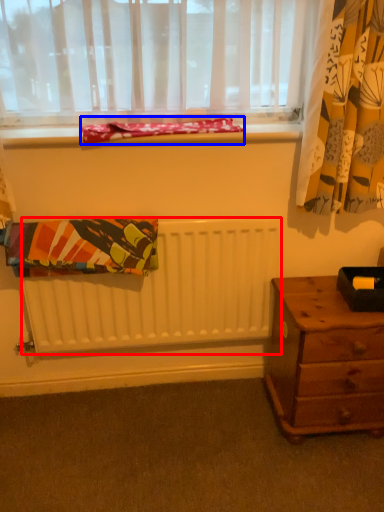
Question: Which of the following is the farthest to the observer, radiator (highlighted by a red box) or blanket (highlighted by a blue box)?

Choices:
 (A) radiator
 (B) blanket

Answer: (A)